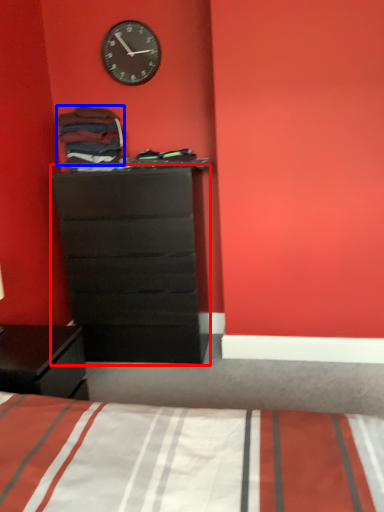
Question: Which point is further to the camera, chest of drawers (highlighted by a red box) or clothing (highlighted by a blue box)?

Choices:
 (A) chest of drawers
 (B) clothing

Answer: (B)